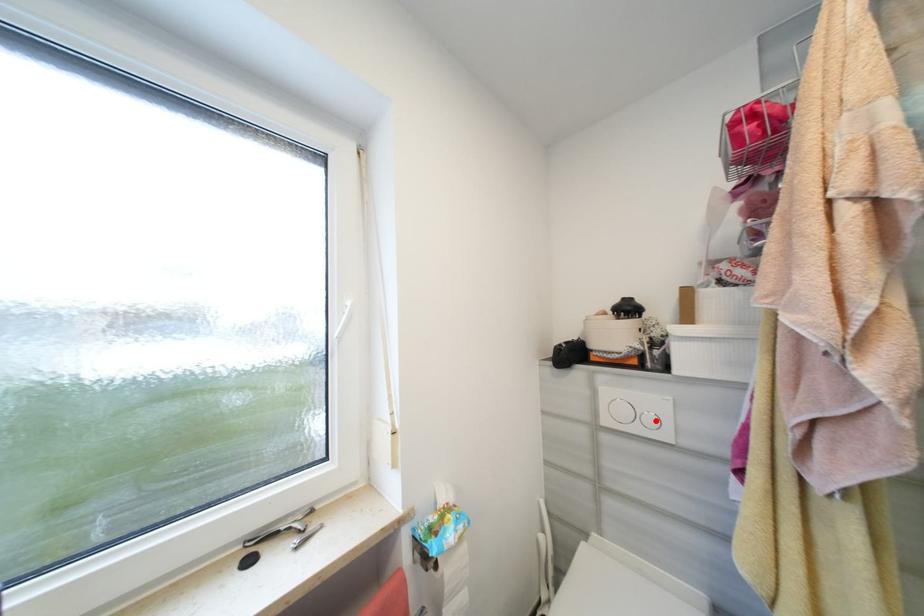
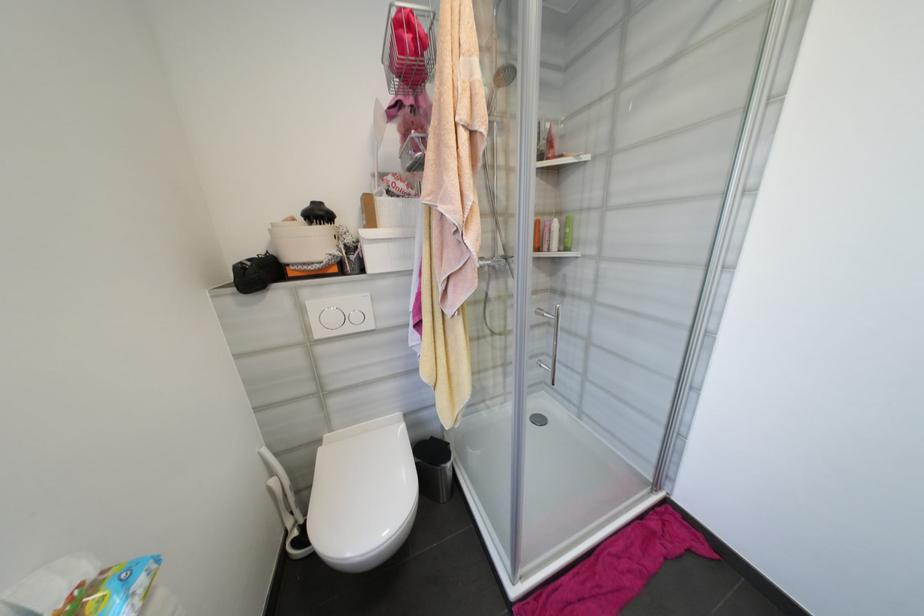
Question: A red point is marked in image1. In image2, is the corresponding 3D point closer to the camera or farther? Reply with the corresponding letter.

Choices:
 (A) The corresponding 3D point is closer.
 (B) The corresponding 3D point is farther.

Answer: (A)